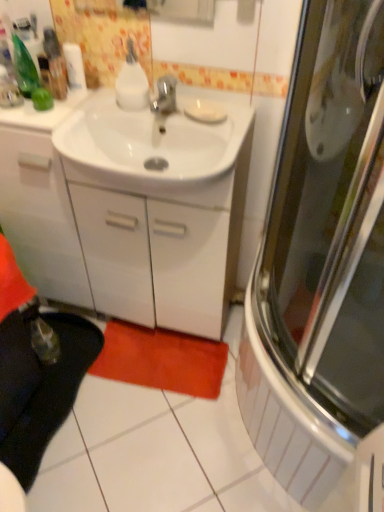
Where is `free point in front of white matte toilet paper at upper left`? This screenshot has width=384, height=512. free point in front of white matte toilet paper at upper left is located at coordinates (64, 116).